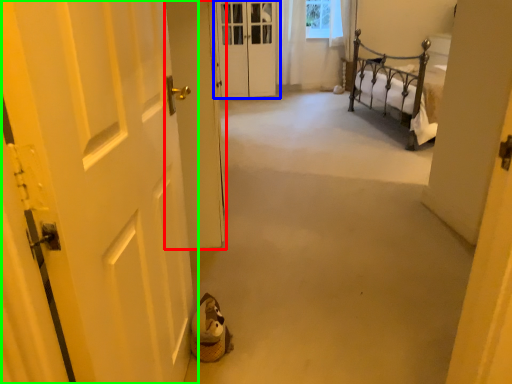
Question: Which object is the closest to the door (highlighted by a red box)? Choose among these: door (highlighted by a blue box) or door (highlighted by a green box).

Choices:
 (A) door
 (B) door

Answer: (B)